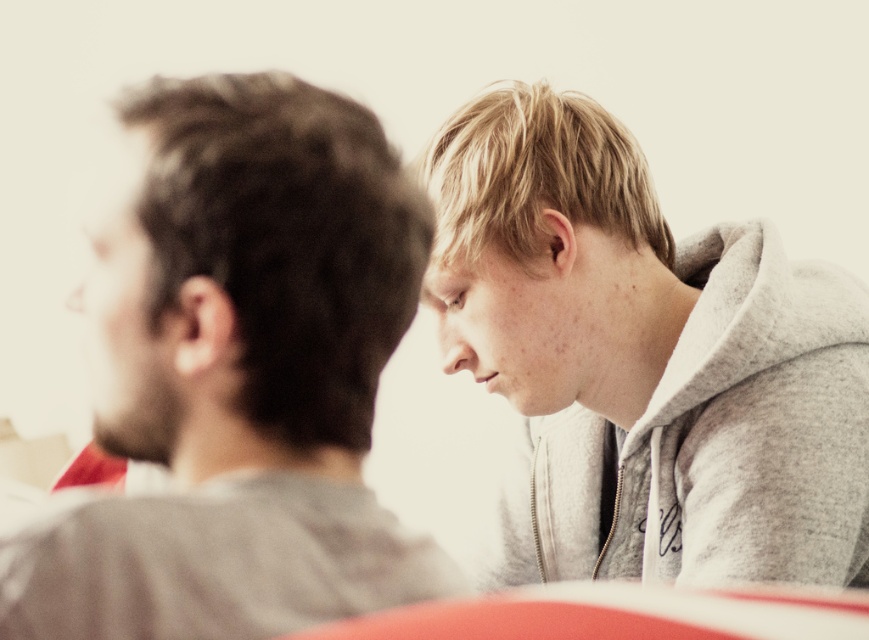
Question: Where is gray matte shirt at left located in relation to gray fleece hoodie at upper right in the image?

Choices:
 (A) above
 (B) below

Answer: (A)

Question: Does gray matte shirt at left have a smaller size compared to gray fleece hoodie at upper right?

Choices:
 (A) yes
 (B) no

Answer: (A)

Question: Is gray matte shirt at left bigger than gray fleece hoodie at upper right?

Choices:
 (A) yes
 (B) no

Answer: (B)

Question: Which object is farther from the camera taking this photo?

Choices:
 (A) gray fleece hoodie at upper right
 (B) gray matte shirt at left

Answer: (A)